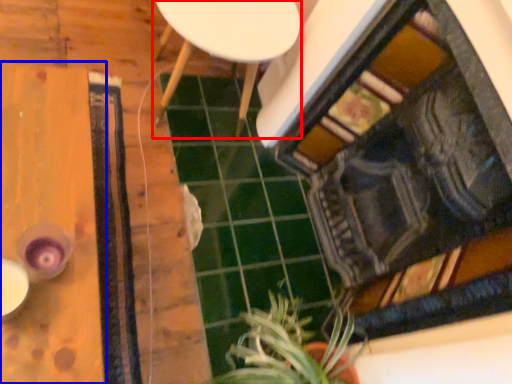
Question: Among these objects, which one is farthest to the camera, furniture (highlighted by a red box) or table (highlighted by a blue box)?

Choices:
 (A) furniture
 (B) table

Answer: (A)